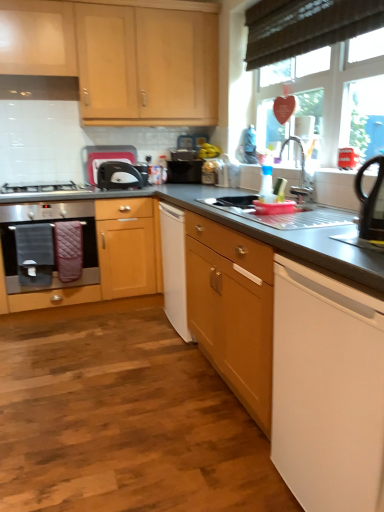
Question: From the image's perspective, is black plastic kettle at right, which ranks as the 1th appliance in front-to-back order, under satin silver gas stove at left?

Choices:
 (A) no
 (B) yes

Answer: (B)

Question: Could you tell me if black plastic kettle at right, placed as the 1th appliance when sorted from right to left, is facing satin silver gas stove at left?

Choices:
 (A) yes
 (B) no

Answer: (B)

Question: Are black plastic kettle at right, the second appliance in the back-to-front sequence, and satin silver gas stove at left far apart?

Choices:
 (A) yes
 (B) no

Answer: (A)

Question: Is black plastic kettle at right, marked as the second appliance in a top-to-bottom arrangement, not inside satin silver gas stove at left?

Choices:
 (A) no
 (B) yes

Answer: (B)

Question: Does black plastic kettle at right, marked as the second appliance in a top-to-bottom arrangement, have a lesser width compared to satin silver gas stove at left?

Choices:
 (A) no
 (B) yes

Answer: (B)

Question: From a real-world perspective, is metallic stainless steel sink at center above or below white plastic toaster at upper center, arranged as the first appliance when viewed from the back?

Choices:
 (A) below
 (B) above

Answer: (A)

Question: Is metallic stainless steel sink at center taller or shorter than white plastic toaster at upper center, which is the second appliance in front-to-back order?

Choices:
 (A) short
 (B) tall

Answer: (A)

Question: Considering the relative positions of metallic stainless steel sink at center and white plastic toaster at upper center, which is the 1th appliance from top to bottom, in the image provided, is metallic stainless steel sink at center to the left or to the right of white plastic toaster at upper center, which is the 1th appliance from top to bottom,?

Choices:
 (A) right
 (B) left

Answer: (A)

Question: Based on their sizes in the image, would you say metallic stainless steel sink at center is bigger or smaller than white plastic toaster at upper center, which is the 1th appliance from top to bottom?

Choices:
 (A) big
 (B) small

Answer: (A)

Question: Would you say black plastic kettle at right, marked as the second appliance in a top-to-bottom arrangement, is to the left or to the right of white plastic toaster at upper center, placed as the first appliance when sorted from left to right, in the picture?

Choices:
 (A) left
 (B) right

Answer: (B)

Question: In terms of width, does black plastic kettle at right, the 2th appliance positioned from the left, look wider or thinner when compared to white plastic toaster at upper center, placed as the first appliance when sorted from left to right?

Choices:
 (A) thin
 (B) wide

Answer: (B)

Question: From a real-world perspective, is black plastic kettle at right, which appears as the first appliance when ordered from the bottom, physically located above or below white plastic toaster at upper center, which is the 1th appliance from top to bottom?

Choices:
 (A) above
 (B) below

Answer: (B)

Question: Is black plastic kettle at right, marked as the second appliance in a top-to-bottom arrangement, situated inside white plastic toaster at upper center, placed as the first appliance when sorted from left to right, or outside?

Choices:
 (A) inside
 (B) outside

Answer: (B)

Question: From a real-world perspective, relative to black plastic kettle at right, which ranks as the 1th appliance in front-to-back order, is white matte dishwasher at lower right, the 1th home appliance in the right-to-left sequence, vertically above or below?

Choices:
 (A) below
 (B) above

Answer: (A)

Question: From the image's perspective, is white matte dishwasher at lower right, the 1th home appliance in the right-to-left sequence, located above or below black plastic kettle at right, which ranks as the 1th appliance in front-to-back order?

Choices:
 (A) above
 (B) below

Answer: (B)